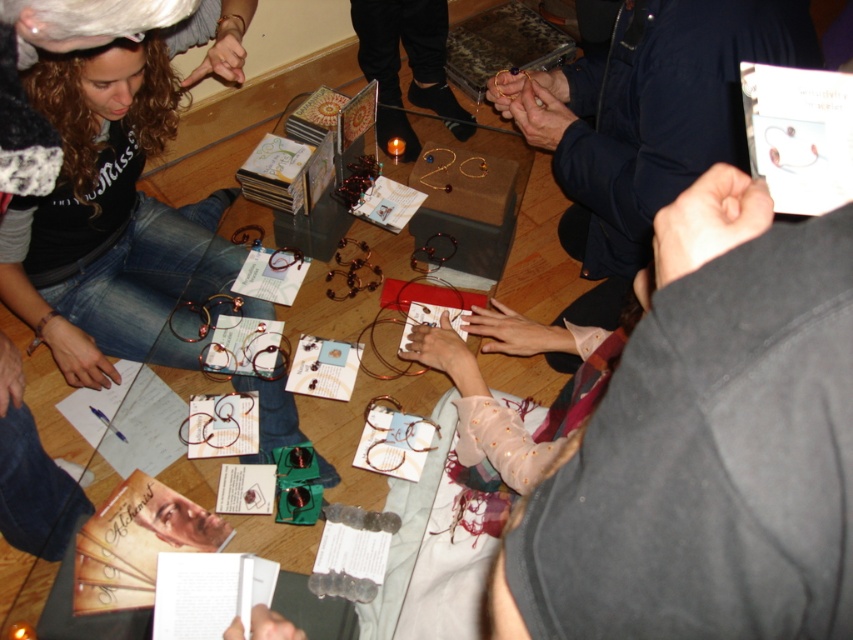
From the picture: You are a customer at a jewelry store and want to pick up the matte black hairband at lower left and the transparent glass table at center. Which object will you need to reach over first?

The matte black hairband at lower left is closer to the viewer than the transparent glass table at center, so you will need to reach over the matte black hairband at lower left first before accessing the transparent glass table at center.

You are organizing a jewelry display and want to arrange the matte black jacket at upper right and the matte black bracelet at center on a shelf. If the shelf has limited space, which item should you place first to maximize space efficiency?

The matte black bracelet at center is narrower than the matte black jacket at upper right. To maximize space efficiency, place the wider matte black jacket at upper right first, then the narrower matte black bracelet at center.

You are organizing a jewelry display and need to ensure that the matte black bracelet at center fits within the transparent glass table at center. Based on their widths, will the bracelet fit without overhanging the edges?

The matte black bracelet at center has a lesser width compared to transparent glass table at center, so it will fit without overhanging the edges.